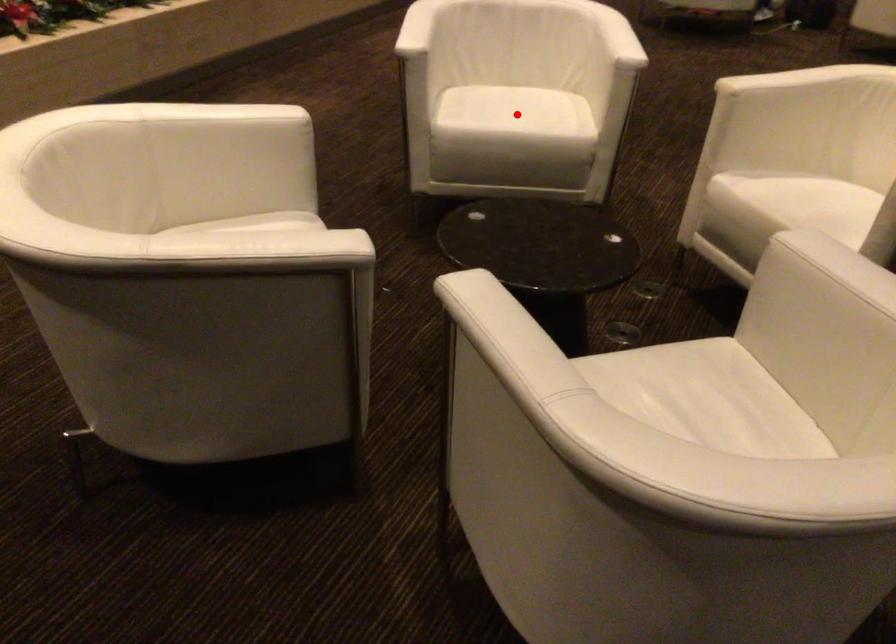
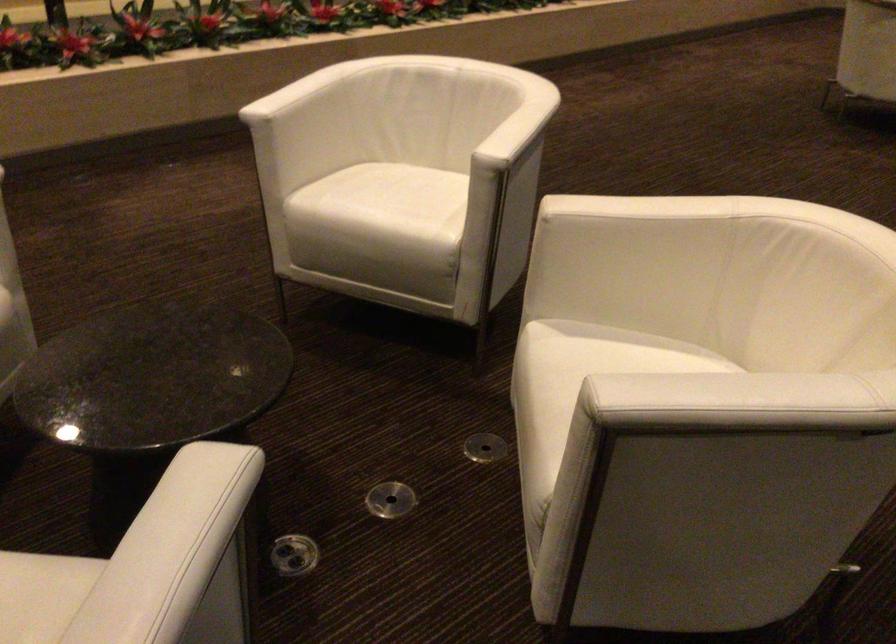
Question: I am providing you with two images of the same scene from different viewpoints. Image1 has a red point marked. In image2, the corresponding 3D location appears at what relative position? Reply with the corresponding letter.

Choices:
 (A) Closer
 (B) Farther

Answer: (A)